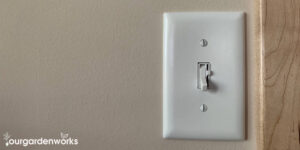
Identify the location of wall. This screenshot has height=150, width=300. (46, 73).